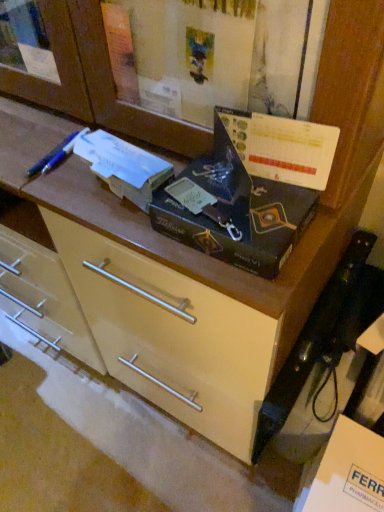
Image resolution: width=384 pixels, height=512 pixels. In order to click on free space above matte cream drawer at center (from a real-world perspective) in this screenshot , I will do `click(97, 432)`.